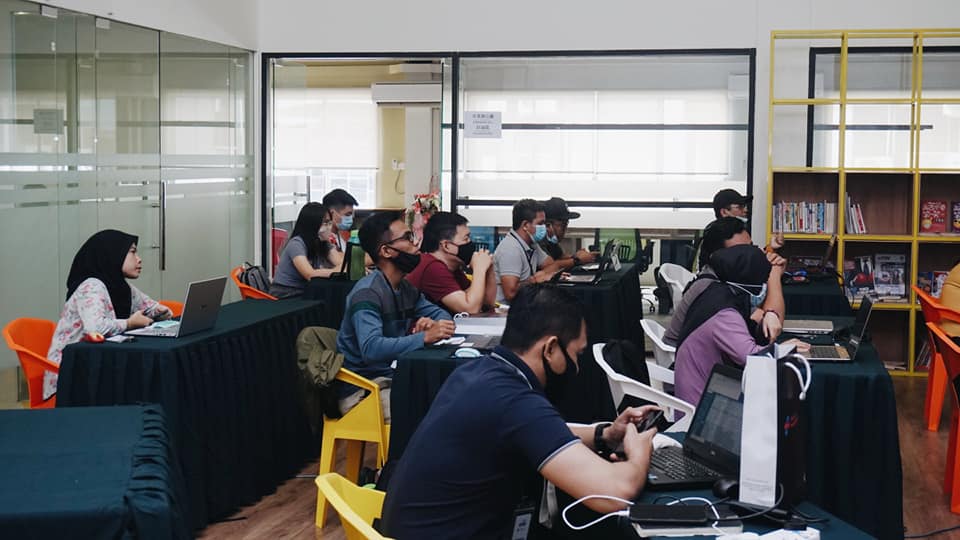
Find the location of a particular element. books is located at coordinates (809, 217), (794, 216).